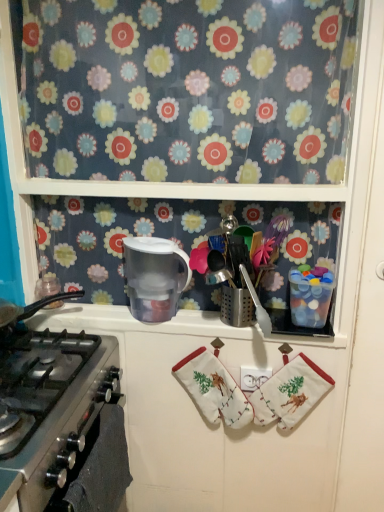
At what (x,y) coordinates should I click in order to perform the action: click on free space above transparent plastic pitcher at upper center, the 1th appliance positioned from the left (from a real-world perspective). Please return your answer as a coordinate pair (x, y). The width and height of the screenshot is (384, 512). Looking at the image, I should click on (150, 237).